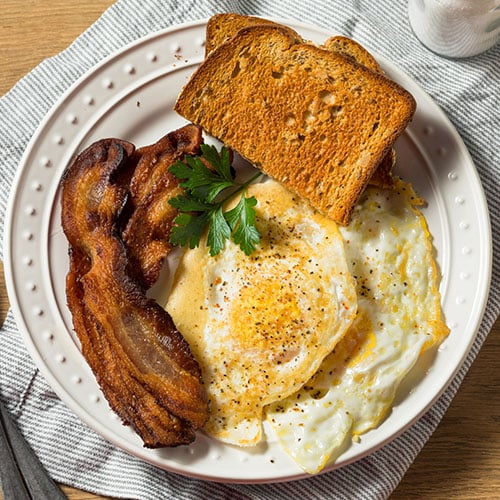
Identify the location of plate. (151, 117).